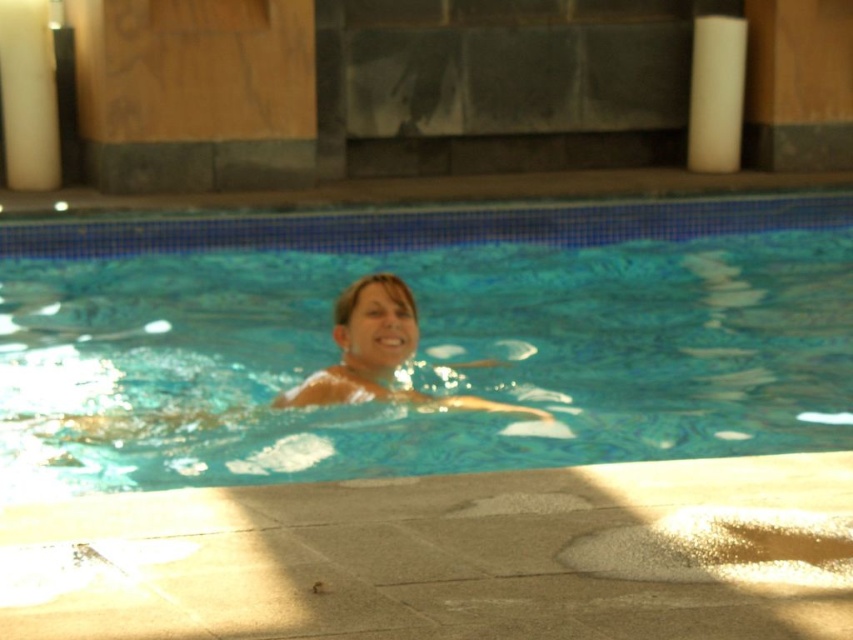
You are standing at the edge of the pool and want to place a floating ring at point (645, 275) and another at point (332, 397). Which point is closer to you?

Point (645, 275) is further to the viewer than point (332, 397), so the point (332, 397) is closer to you.